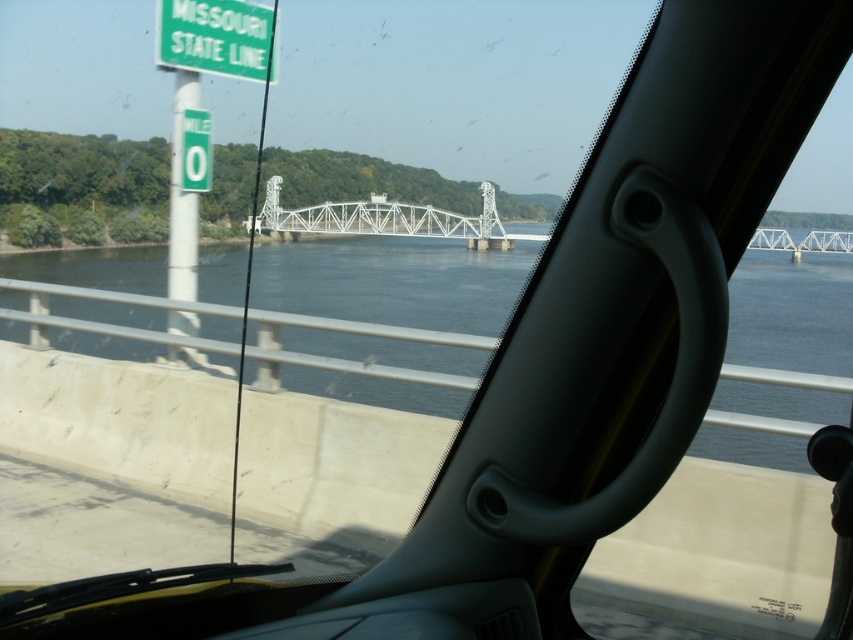
How much distance is there between dark blue water at center and white metallic bridge at center?

dark blue water at center and white metallic bridge at center are 2.05 meters apart.

Which is behind, point (833, 314) or point (296, 234)?

The point (296, 234) is more distant.

Locate an element on the screen. The width and height of the screenshot is (853, 640). dark blue water at center is located at coordinates (392, 280).

Can you confirm if green matte sign at upper left is wider than white metallic bridge at center?

No.

Between green matte sign at upper left and white metallic bridge at center, which one is positioned higher?

green matte sign at upper left

The image size is (853, 640). Find the location of `green matte sign at upper left`. green matte sign at upper left is located at coordinates (216, 36).

You are a GUI agent. You are given a task and a screenshot of the screen. Output one action in this format:
    pyautogui.click(x=<x>, y=<y>)
    Task: Click on the green matte sign at upper left
    The height and width of the screenshot is (640, 853).
    Given the screenshot: What is the action you would take?
    pyautogui.click(x=216, y=36)

Is point (427, 365) more distant than point (252, 24)?

That is False.

Is point (57, 300) positioned in front of point (158, 38)?

No, it is behind (158, 38).

This screenshot has height=640, width=853. Identify the location of dark blue water at center. (392, 280).